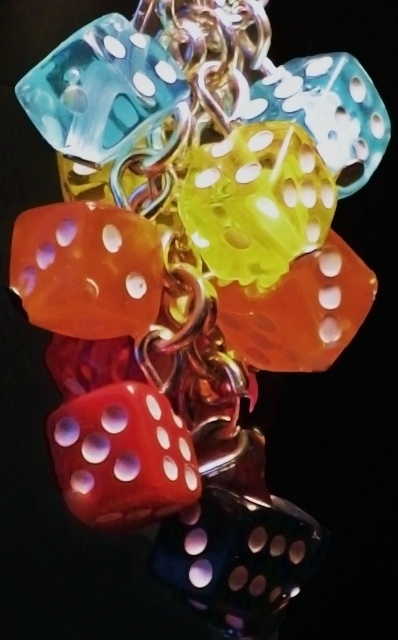
Question: Does translucent yellow dice at center appear on the right side of translucent blue dice at upper left?

Choices:
 (A) yes
 (B) no

Answer: (A)

Question: Is translucent yellow dice at center thinner than translucent blue dice at upper left?

Choices:
 (A) yes
 (B) no

Answer: (A)

Question: Which point is closer to the camera?

Choices:
 (A) translucent yellow dice at center
 (B) translucent blue dice at upper left

Answer: (A)

Question: Where is translucent yellow dice at center located in relation to translucent blue dice at upper left in the image?

Choices:
 (A) below
 (B) above

Answer: (A)

Question: Which object is farther from the camera taking this photo?

Choices:
 (A) translucent yellow dice at center
 (B) translucent blue dice at upper left

Answer: (B)

Question: Which point is farther to the camera?

Choices:
 (A) (169, 77)
 (B) (321, 221)

Answer: (A)